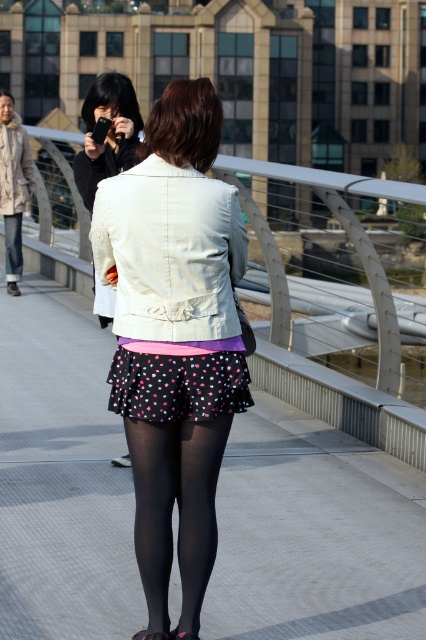
Question: Does polka dot skirt at center lie in front of white matte jacket at center?

Choices:
 (A) yes
 (B) no

Answer: (A)

Question: Which point is closer to the camera?

Choices:
 (A) (23, 148)
 (B) (201, 580)
 (C) (172, 404)
 (D) (97, 152)

Answer: (C)

Question: Observing the image, what is the correct spatial positioning of matte white jacket at center in reference to beige fur-lined coat at left?

Choices:
 (A) left
 (B) right

Answer: (B)

Question: Does black tights at center have a larger size compared to beige fur-lined coat at left?

Choices:
 (A) yes
 (B) no

Answer: (B)

Question: Which point is farther to the camera?

Choices:
 (A) beige fur-lined coat at left
 (B) matte white jacket at center
 (C) white matte jacket at center

Answer: (A)

Question: Which point is closer to the camera?

Choices:
 (A) polka dot skirt at center
 (B) white matte jacket at center
 (C) matte white jacket at center

Answer: (C)